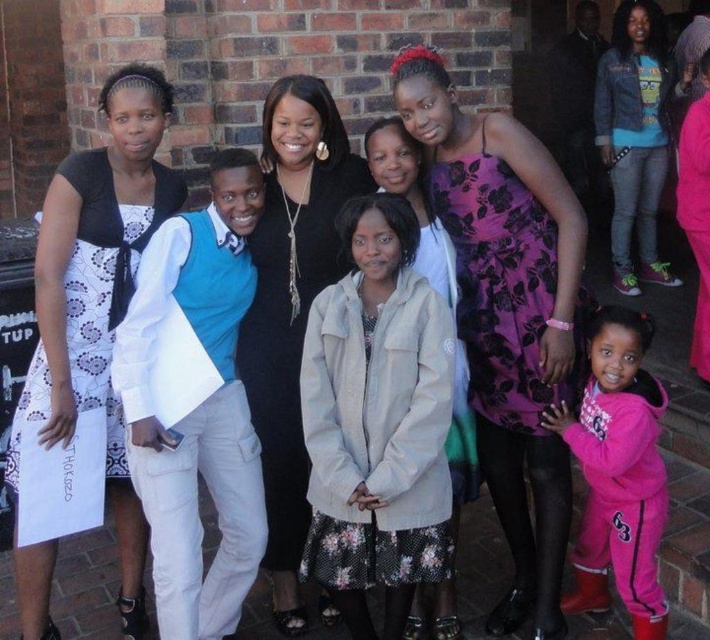
Is white lace dress at left to the right of pink fleece jacket at lower right from the viewer's perspective?

No, white lace dress at left is not to the right of pink fleece jacket at lower right.

Who is higher up, white lace dress at left or pink fleece jacket at lower right?

white lace dress at left

Where is `white lace dress at left`? This screenshot has width=710, height=640. white lace dress at left is located at coordinates (92, 326).

Does matte black dress at center appear on the left side of pink fleece jacket at lower right?

Yes, matte black dress at center is to the left of pink fleece jacket at lower right.

I want to click on matte black dress at center, so click(293, 305).

Is purple floral dress at center taller than white lace dress at left?

Yes, purple floral dress at center is taller than white lace dress at left.

Measure the distance between purple floral dress at center and camera.

A distance of 3.74 meters exists between purple floral dress at center and camera.

You are a GUI agent. You are given a task and a screenshot of the screen. Output one action in this format:
    pyautogui.click(x=<x>, y=<y>)
    Task: Click on the purple floral dress at center
    This screenshot has height=640, width=710.
    Given the screenshot: What is the action you would take?
    pyautogui.click(x=507, y=316)